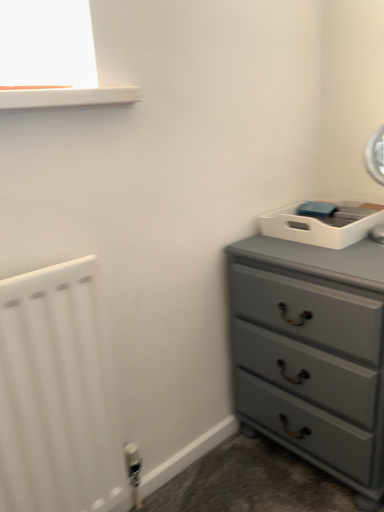
Locate an element on the screen. matte gray dresser at right is located at coordinates (312, 353).

What do you see at coordinates (312, 353) in the screenshot? I see `matte gray dresser at right` at bounding box center [312, 353].

Image resolution: width=384 pixels, height=512 pixels. In order to click on white matte radiator at left in this screenshot , I will do `click(57, 394)`.

What do you see at coordinates (57, 394) in the screenshot? The height and width of the screenshot is (512, 384). I see `white matte radiator at left` at bounding box center [57, 394].

You are a GUI agent. You are given a task and a screenshot of the screen. Output one action in this format:
    pyautogui.click(x=<x>, y=<y>)
    Task: Click on the matte gray dresser at right
    This screenshot has width=384, height=512.
    Given the screenshot: What is the action you would take?
    pyautogui.click(x=312, y=353)

Looking at this image, does white matte radiator at left appear on the right side of matte gray dresser at right?

No.

Is white matte radiator at left further to camera compared to matte gray dresser at right?

No, white matte radiator at left is closer to the camera.

Does point (96, 325) appear closer or farther from the camera than point (263, 252)?

Point (96, 325).

From the image's perspective, does white matte radiator at left appear lower than matte gray dresser at right?

Yes, from the image's perspective, white matte radiator at left is below matte gray dresser at right.

From a real-world perspective, is white matte radiator at left on top of matte gray dresser at right?

Yes, from a real-world perspective, white matte radiator at left is on top of matte gray dresser at right.

Considering the sizes of objects white matte radiator at left and matte gray dresser at right in the image provided, who is wider, white matte radiator at left or matte gray dresser at right?

matte gray dresser at right is wider.

Who is shorter, white matte radiator at left or matte gray dresser at right?

matte gray dresser at right is shorter.

Is white matte radiator at left smaller than matte gray dresser at right?

Indeed, white matte radiator at left has a smaller size compared to matte gray dresser at right.

Does white matte radiator at left contain matte gray dresser at right?

No, matte gray dresser at right is located outside of white matte radiator at left.

Is white matte radiator at left not near matte gray dresser at right?

white matte radiator at left is actually quite close to matte gray dresser at right.

Based on the photo, is white matte radiator at left facing away from matte gray dresser at right?

No, white matte radiator at left is not facing the opposite direction of matte gray dresser at right.

The height and width of the screenshot is (512, 384). I want to click on chest of drawers below the white matte radiator at left (from a real-world perspective), so click(x=312, y=353).

Does matte gray dresser at right appear on the left side of white matte radiator at left?

No.

Which object is further away from the camera taking this photo, matte gray dresser at right or white matte radiator at left?

matte gray dresser at right.

Between point (319, 343) and point (87, 268), which one is positioned behind?

The point (319, 343) is behind.

From the image's perspective, is matte gray dresser at right located above or below white matte radiator at left?

Based on their image positions, matte gray dresser at right is located above white matte radiator at left.

From a real-world perspective, is matte gray dresser at right physically located above or below white matte radiator at left?

From a real-world perspective, matte gray dresser at right is physically below white matte radiator at left.

Is matte gray dresser at right thinner than white matte radiator at left?

No.

Considering the relative sizes of matte gray dresser at right and white matte radiator at left in the image provided, is matte gray dresser at right taller than white matte radiator at left?

In fact, matte gray dresser at right may be shorter than white matte radiator at left.

Does matte gray dresser at right have a larger size compared to white matte radiator at left?

Indeed, matte gray dresser at right has a larger size compared to white matte radiator at left.

Is matte gray dresser at right not within white matte radiator at left?

Absolutely, matte gray dresser at right is external to white matte radiator at left.

Is matte gray dresser at right beside white matte radiator at left?

No, matte gray dresser at right is not in contact with white matte radiator at left.

Is matte gray dresser at right looking in the opposite direction of white matte radiator at left?

No.

How many degrees apart are the facing directions of matte gray dresser at right and white matte radiator at left?

The angular difference between matte gray dresser at right and white matte radiator at left is 88.9 degrees.

The width and height of the screenshot is (384, 512). In order to click on radiator positioned vertically above the matte gray dresser at right (from a real-world perspective) in this screenshot , I will do `click(57, 394)`.

The height and width of the screenshot is (512, 384). In order to click on the chest of drawers above the white matte radiator at left (from the image's perspective) in this screenshot , I will do `click(312, 353)`.

This screenshot has height=512, width=384. I want to click on chest of drawers that appears on the right of white matte radiator at left, so click(x=312, y=353).